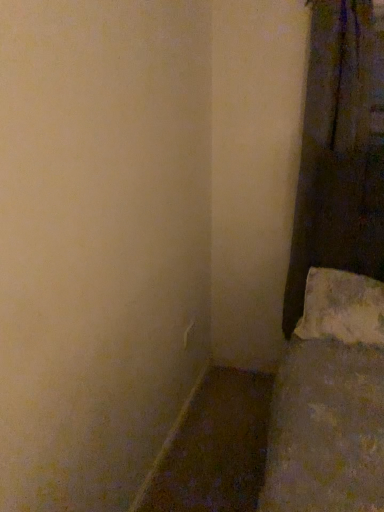
Question: From the image's perspective, relative to dark fabric curtain at right, is matte brown wood at lower left above or below?

Choices:
 (A) above
 (B) below

Answer: (B)

Question: Is matte brown wood at lower left to the left or to the right of dark fabric curtain at right in the image?

Choices:
 (A) right
 (B) left

Answer: (B)

Question: Which of these objects is positioned farthest from the dark fabric curtain at right?

Choices:
 (A) matte brown wood at lower left
 (B) white textured pillow at lower right

Answer: (A)

Question: Estimate the real-world distances between objects in this image. Which object is closer to the white textured pillow at lower right?

Choices:
 (A) matte brown wood at lower left
 (B) dark fabric curtain at right

Answer: (B)